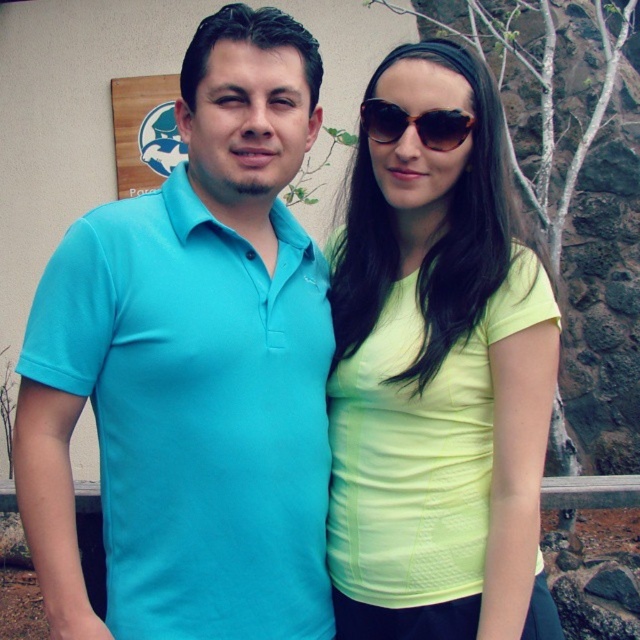
Question: Which point is closer to the camera taking this photo?

Choices:
 (A) (426, 124)
 (B) (132, 544)

Answer: (B)

Question: Is neon yellow fabric at center positioned in front of brown textured sunglasses at center?

Choices:
 (A) yes
 (B) no

Answer: (A)

Question: Which point appears closest to the camera in this image?

Choices:
 (A) (444, 125)
 (B) (484, 442)

Answer: (A)

Question: Considering the relative positions of matte blue polo shirt at left and neon yellow fabric at center in the image provided, where is matte blue polo shirt at left located with respect to neon yellow fabric at center?

Choices:
 (A) left
 (B) right

Answer: (A)

Question: Can you confirm if neon yellow fabric at center is thinner than brown textured sunglasses at center?

Choices:
 (A) yes
 (B) no

Answer: (B)

Question: Which point is farther to the camera?

Choices:
 (A) (218, 282)
 (B) (467, 461)

Answer: (A)